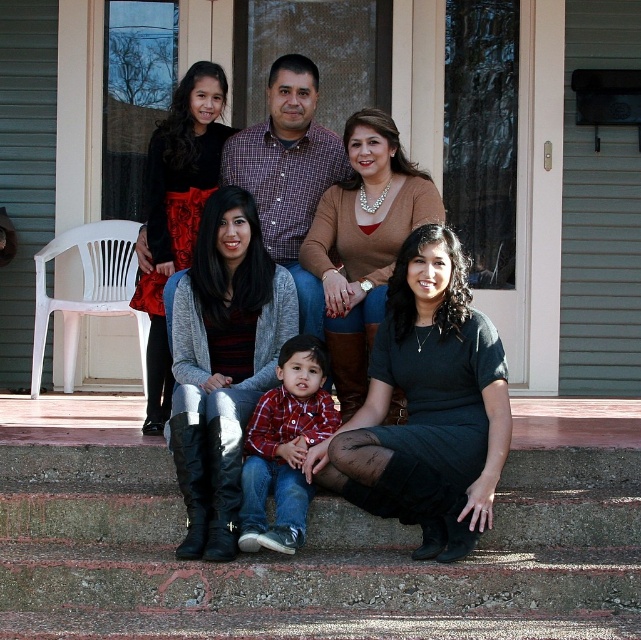
Does point (574, 614) come farther from viewer compared to point (456, 428)?

No, it is in front of (456, 428).

Is concrete stairs at lower center to the left of black dress at lower center from the viewer's perspective?

Yes, concrete stairs at lower center is to the left of black dress at lower center.

Which is in front, point (56, 484) or point (465, 432)?

Point (465, 432) is in front.

You are a GUI agent. You are given a task and a screenshot of the screen. Output one action in this format:
    pyautogui.click(x=<x>, y=<y>)
    Task: Click on the concrete stairs at lower center
    This screenshot has height=640, width=641.
    Given the screenshot: What is the action you would take?
    pyautogui.click(x=313, y=556)

Does matte black boots at lower left have a lesser width compared to plaid shirt at center?

In fact, matte black boots at lower left might be wider than plaid shirt at center.

Between matte black boots at lower left and plaid shirt at center, which one is positioned higher?

Positioned higher is matte black boots at lower left.

Is point (460, 298) positioned after point (287, 506)?

Yes.

Image resolution: width=641 pixels, height=640 pixels. Find the location of `matte black boots at lower left`. matte black boots at lower left is located at coordinates (394, 337).

Between concrete stairs at lower center and matte black boots at lower left, which one is positioned higher?

Positioned higher is matte black boots at lower left.

Based on the photo, who is shorter, concrete stairs at lower center or matte black boots at lower left?

concrete stairs at lower center is shorter.

Where is `concrete stairs at lower center`? concrete stairs at lower center is located at coordinates (313, 556).